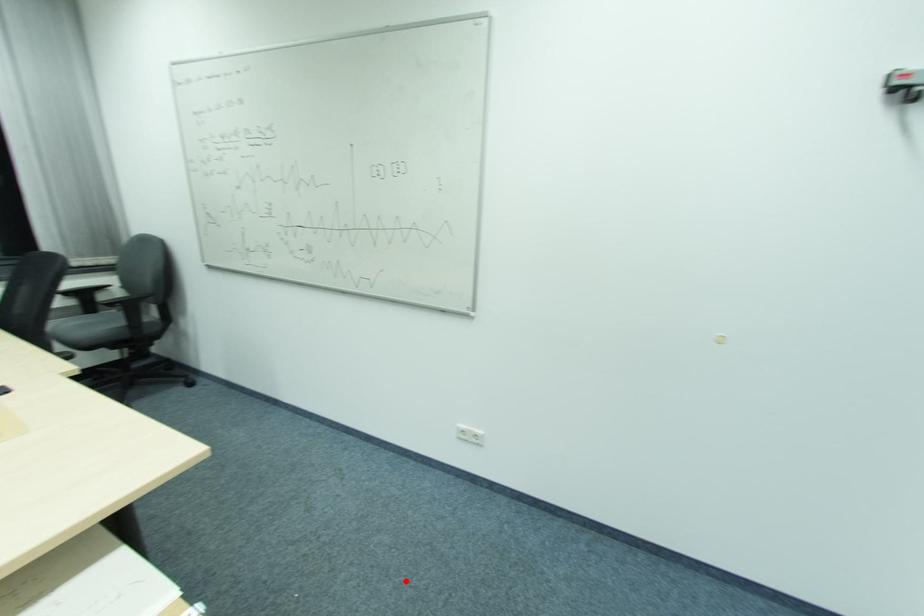
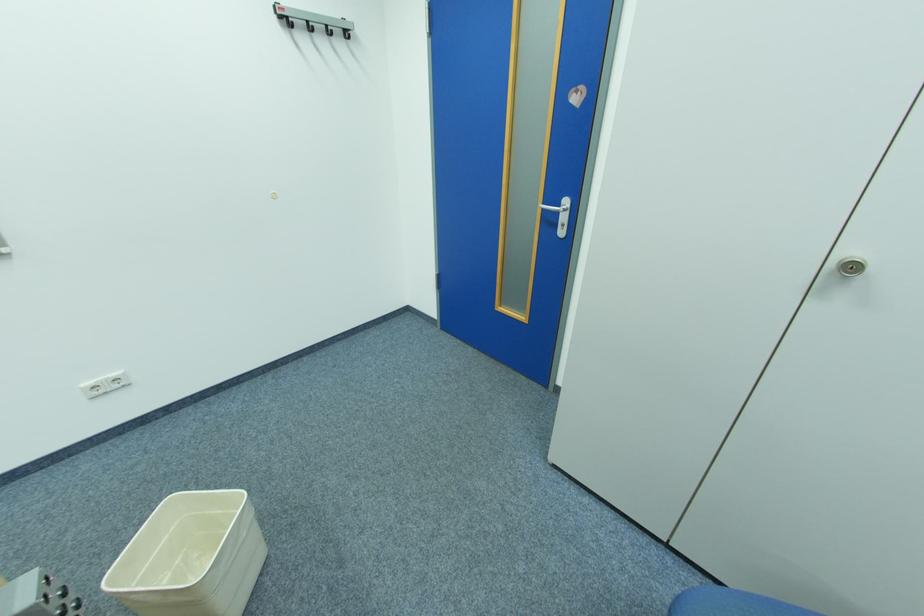
Find the pixel in the second image that matches the highlighted location in the first image.

(143, 522)